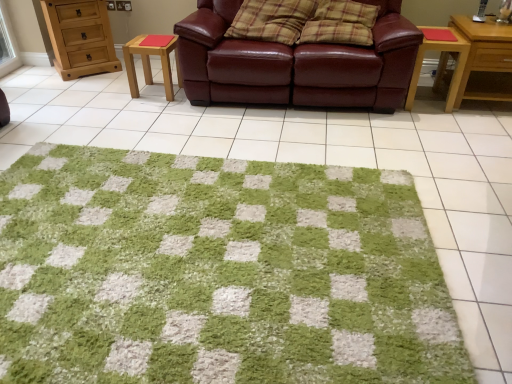
Where is `free space that is to the left of light brown wooden chest of drawers at upper left`? Image resolution: width=512 pixels, height=384 pixels. free space that is to the left of light brown wooden chest of drawers at upper left is located at coordinates (35, 72).